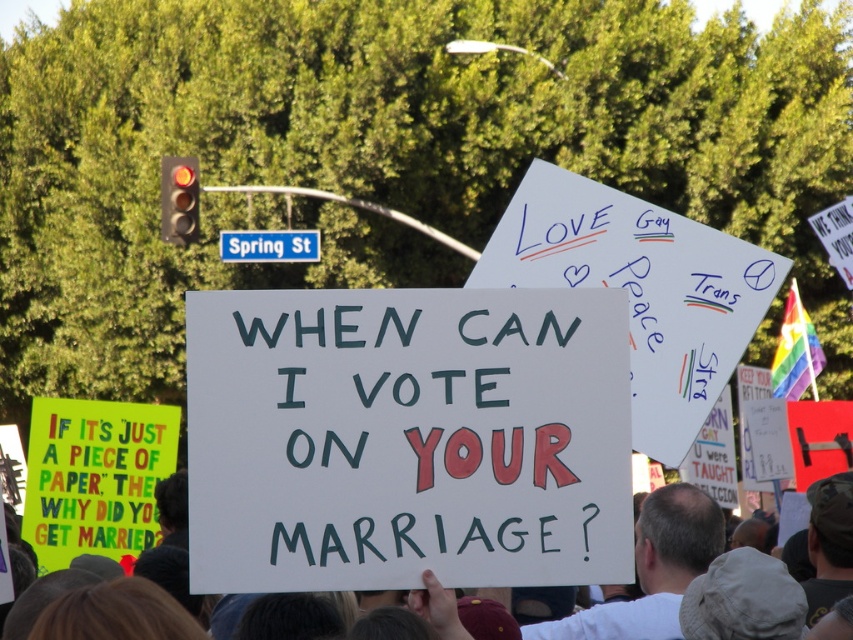
You are a photographer standing at the center of the protest scene. You want to take a photo that includes both the white paper sign at center and the blue plastic street sign at upper center. Given that your camera has a 50mm lens, which has a field of view of about 46 degrees, can you capture both objects in a single frame without moving? Explain your reasoning based on their distance apart.

The white paper sign at center is 18.30 meters away from the blue plastic street sign at upper center. With a 50mm lens providing a 46 degree field of view, the maximum distance between two objects that can be captured in a single frame depends on their angular separation. However, the given information only provides linear distance between the signs, not their angular separation from the photographer. Without knowing their positions relative to the photographer, it is impossible to determine if they fit in

From the picture: You are a photographer trying to capture both the white paper sign at center and the blue plastic street sign at upper center in a single frame. Given their heights, which sign will appear larger in your photo?

The white paper sign at center will appear larger in the photo because it has a greater height compared to the blue plastic street sign at upper center.